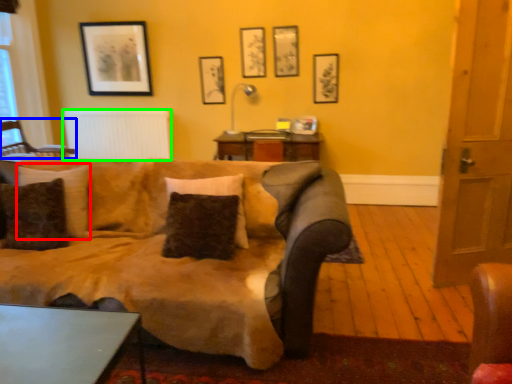
Question: Based on their relative distances, which object is farther from pillow (highlighted by a red box)? Choose from chair (highlighted by a blue box) and radiator (highlighted by a green box).

Choices:
 (A) chair
 (B) radiator

Answer: (B)